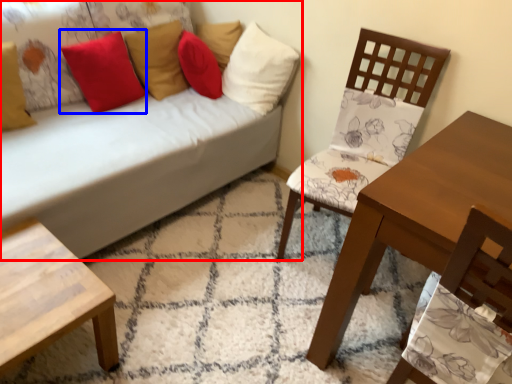
Question: Which of the following is the closest to the observer, studio couch (highlighted by a red box) or pillow (highlighted by a blue box)?

Choices:
 (A) studio couch
 (B) pillow

Answer: (A)